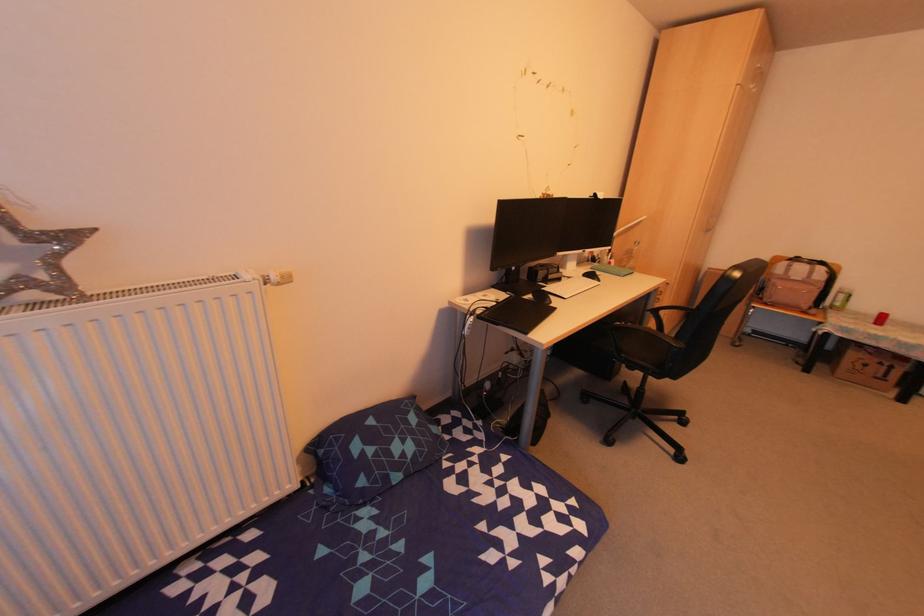
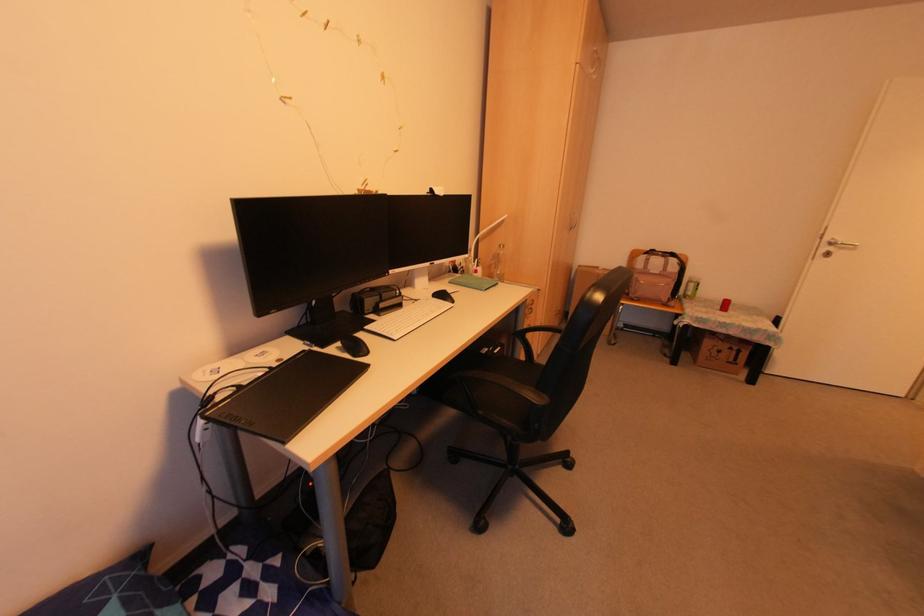
Locate, in the second image, the point that corresponds to point 637,244 in the first image.

(502, 246)